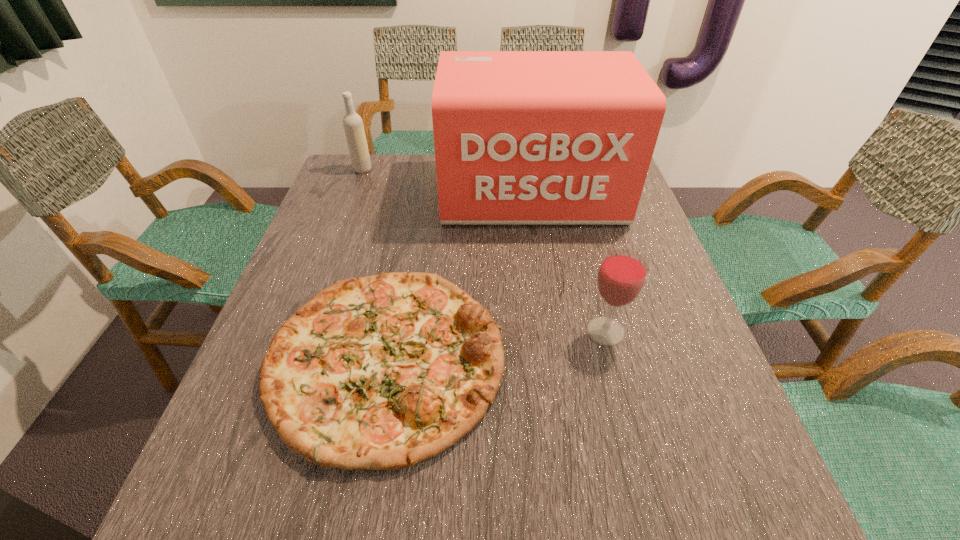
Identify the location of vacant space at the right edge of the desktop. (682, 444).

In the image, there is a desktop. Identify the location of vacant space at the far left corner. (388, 172).

In the image, there is a desktop. Identify the location of vacant space at the near right corner. [730, 501].

The image size is (960, 540). Identify the location of vacant space that is in between the pizza and the box. (459, 276).

This screenshot has width=960, height=540. Find the location of `free point between the third tallest object and the third shortest object`. free point between the third tallest object and the third shortest object is located at coordinates (484, 251).

Locate an element on the screen. free space between the wineglass and the box is located at coordinates (568, 262).

Locate an element on the screen. The width and height of the screenshot is (960, 540). vacant area that lies between the wineglass and the second tallest object is located at coordinates (484, 251).

You are a GUI agent. You are given a task and a screenshot of the screen. Output one action in this format:
    pyautogui.click(x=<x>, y=<y>)
    Task: Click on the free space between the third shortest object and the wineglass
    This screenshot has height=540, width=960.
    Given the screenshot: What is the action you would take?
    pyautogui.click(x=484, y=251)

Where is `free space between the vodka and the third tallest object`? The width and height of the screenshot is (960, 540). free space between the vodka and the third tallest object is located at coordinates (484, 251).

Where is `free space that is in between the second shortest object and the tallest object`? The image size is (960, 540). free space that is in between the second shortest object and the tallest object is located at coordinates (568, 262).